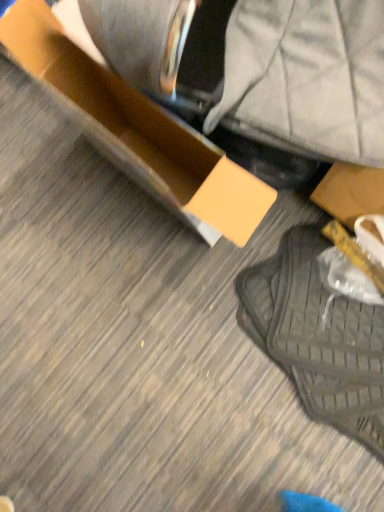
Where is `blank area to the left of matte cardboard box at center`? This screenshot has width=384, height=512. blank area to the left of matte cardboard box at center is located at coordinates (77, 238).